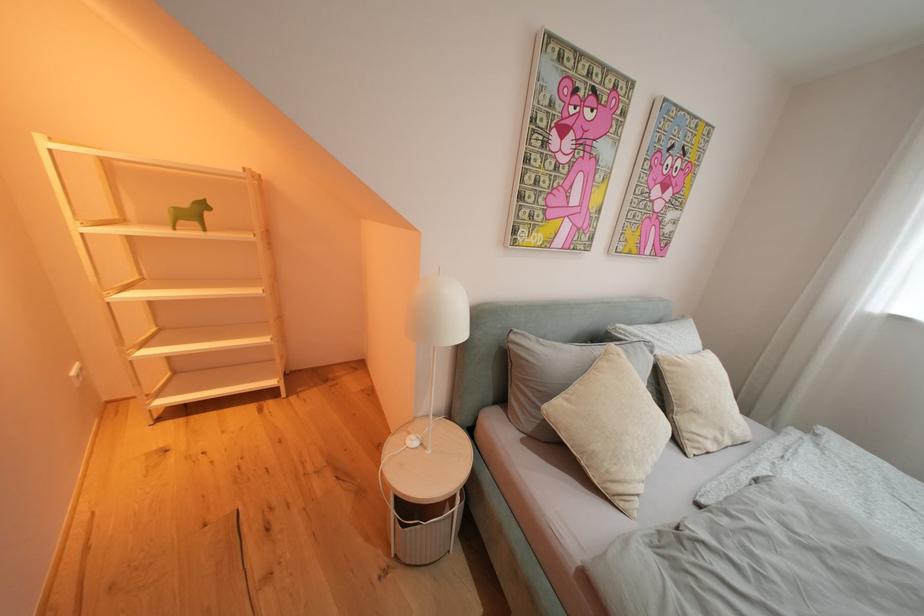
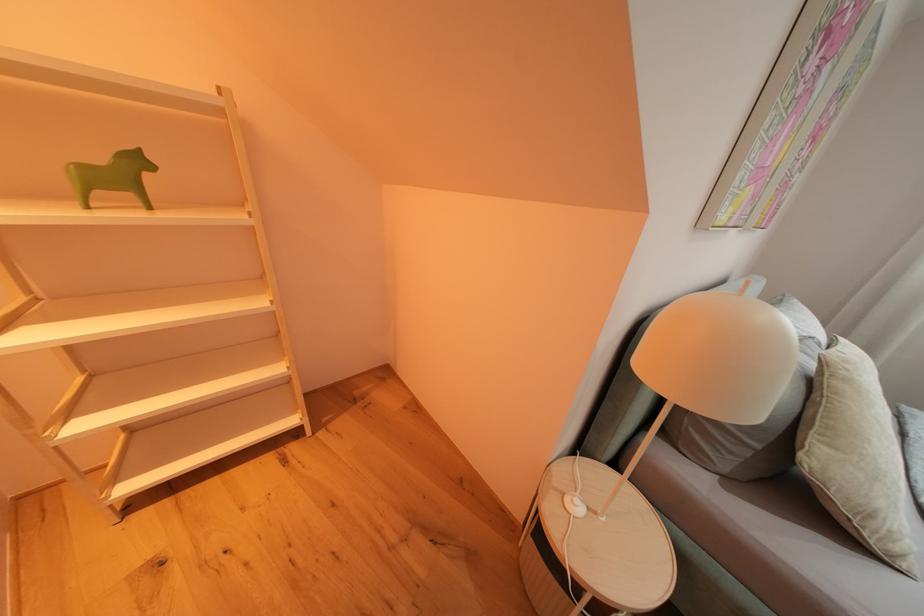
Question: How did the camera likely rotate?

Choices:
 (A) Left
 (B) Right
 (C) Up
 (D) Down

Answer: (B)